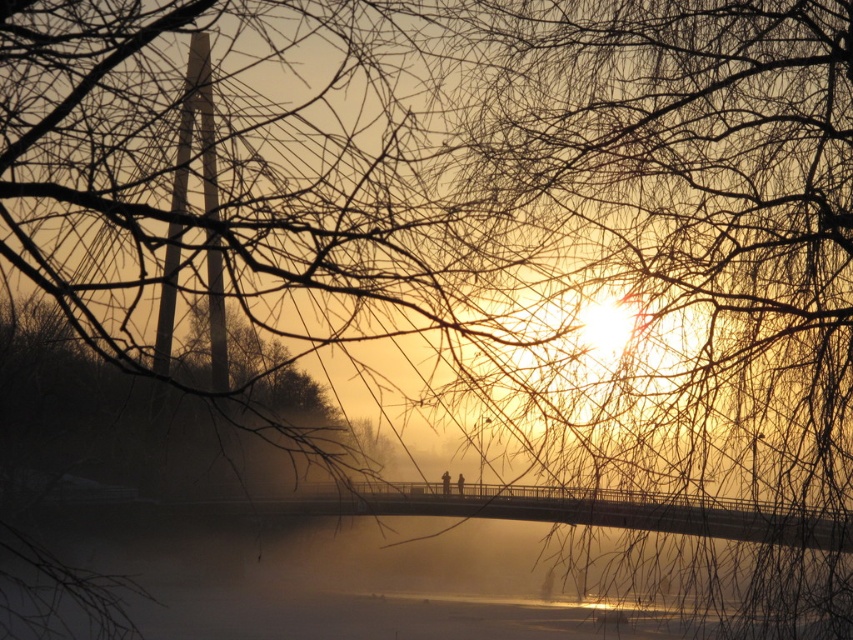
Question: Is translucent misty water at center positioned behind brown matte tree at center?

Choices:
 (A) yes
 (B) no

Answer: (A)

Question: Which point is farther from the camera taking this photo?

Choices:
 (A) (167, 400)
 (B) (340, 620)

Answer: (B)

Question: Is translucent misty water at center above brown matte tree at center?

Choices:
 (A) no
 (B) yes

Answer: (A)

Question: Which point is farther to the camera?

Choices:
 (A) translucent misty water at center
 (B) brown matte tree at center

Answer: (A)

Question: Is translucent misty water at center positioned behind brown matte tree at center?

Choices:
 (A) no
 (B) yes

Answer: (B)

Question: Among these points, which one is nearest to the camera?

Choices:
 (A) (244, 339)
 (B) (134, 528)

Answer: (A)